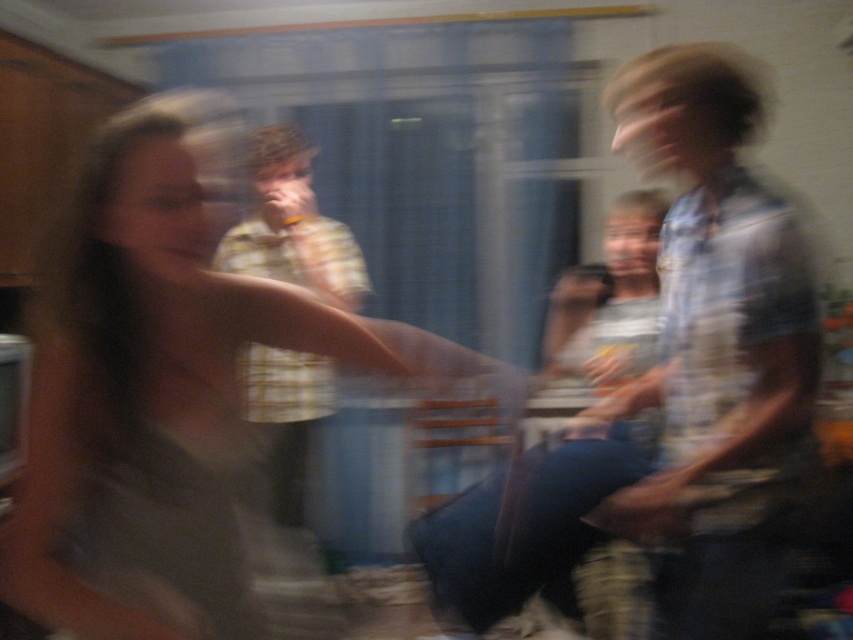
Is matte gray tank top at center positioned in front of blue striped shirt at right?

Yes, it is in front of blue striped shirt at right.

Which of these two, matte gray tank top at center or blue striped shirt at right, stands shorter?

Standing shorter between the two is matte gray tank top at center.

Who is more forward, (x=410, y=333) or (x=700, y=506)?

Positioned in front is point (x=410, y=333).

The height and width of the screenshot is (640, 853). Identify the location of matte gray tank top at center. (160, 387).

Can you confirm if blue striped shirt at right is thinner than yellow plaid shirt at center?

Yes, blue striped shirt at right is thinner than yellow plaid shirt at center.

Who is lower down, blue striped shirt at right or yellow plaid shirt at center?

blue striped shirt at right is below.

Measure the distance between blue striped shirt at right and camera.

The distance of blue striped shirt at right from camera is 1.29 meters.

Locate an element on the screen. Image resolution: width=853 pixels, height=640 pixels. blue striped shirt at right is located at coordinates 715,353.

Who is positioned more to the right, matte gray tank top at center or yellow plaid shirt at center?

From the viewer's perspective, matte gray tank top at center appears more on the right side.

Who is more distant from viewer, [132,410] or [274,392]?

Point [274,392]

You are a GUI agent. You are given a task and a screenshot of the screen. Output one action in this format:
    pyautogui.click(x=<x>, y=<y>)
    Task: Click on the matte gray tank top at center
    This screenshot has height=640, width=853.
    Given the screenshot: What is the action you would take?
    pyautogui.click(x=160, y=387)